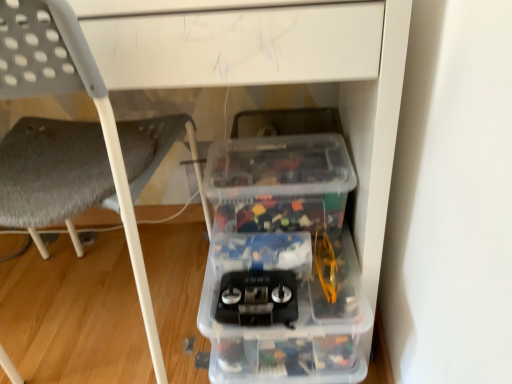
Question: In the image, is gray fabric chair at lower left on the left side or the right side of transparent plastic storage box at lower right?

Choices:
 (A) left
 (B) right

Answer: (A)

Question: From a real-world perspective, is gray fabric chair at lower left physically located above or below transparent plastic storage box at lower right?

Choices:
 (A) below
 (B) above

Answer: (B)

Question: Is point (119, 177) positioned closer to the camera than point (337, 294)?

Choices:
 (A) farther
 (B) closer

Answer: (B)

Question: In the image, is transparent plastic storage box at lower right on the left side or the right side of gray fabric chair at lower left?

Choices:
 (A) right
 (B) left

Answer: (A)

Question: In the image, is transparent plastic storage box at lower right positioned in front of or behind gray fabric chair at lower left?

Choices:
 (A) front
 (B) behind

Answer: (B)

Question: From their relative heights in the image, would you say transparent plastic storage box at lower right is taller or shorter than gray fabric chair at lower left?

Choices:
 (A) tall
 (B) short

Answer: (B)

Question: From the image's perspective, is transparent plastic storage box at lower right positioned above or below gray fabric chair at lower left?

Choices:
 (A) below
 (B) above

Answer: (A)